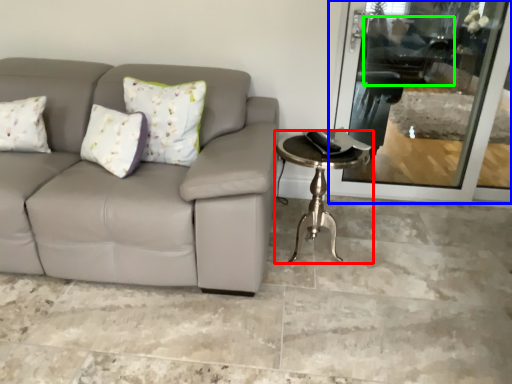
Question: Which is nearer to the table (highlighted by a red box)? screen door (highlighted by a blue box) or swivel chair (highlighted by a green box).

Choices:
 (A) screen door
 (B) swivel chair

Answer: (A)